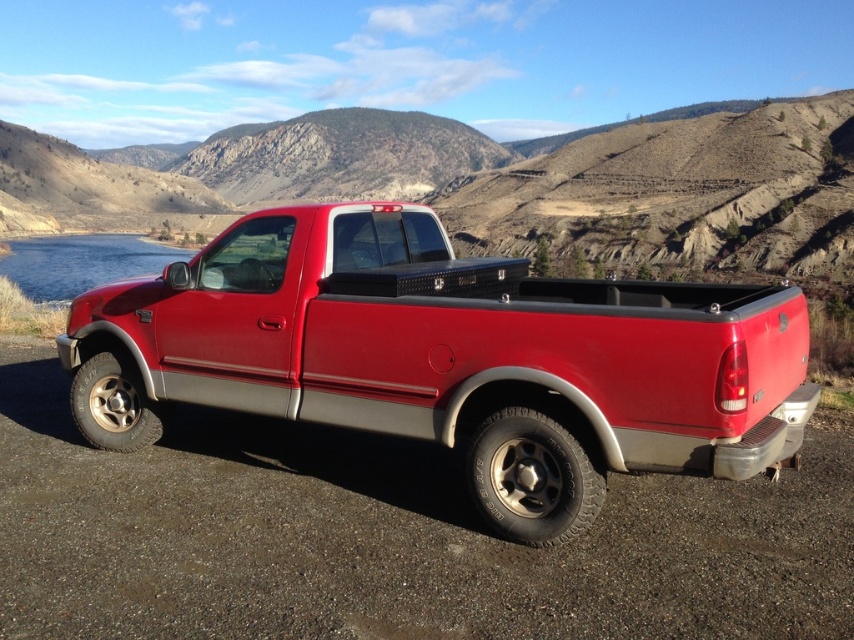
Question: Can you confirm if matte red truck at center is positioned to the left of blue glassy water at left?

Choices:
 (A) yes
 (B) no

Answer: (B)

Question: Is matte red truck at center behind blue glassy water at left?

Choices:
 (A) no
 (B) yes

Answer: (A)

Question: From the image, what is the correct spatial relationship of matte red truck at center in relation to blue glassy water at left?

Choices:
 (A) left
 (B) right

Answer: (B)

Question: Which point is closer to the camera?

Choices:
 (A) blue glassy water at left
 (B) matte red truck at center

Answer: (B)

Question: Which point appears closest to the camera in this image?

Choices:
 (A) (36, 237)
 (B) (525, 544)

Answer: (B)

Question: Which point is closer to the camera taking this photo?

Choices:
 (A) (328, 269)
 (B) (0, 260)

Answer: (A)